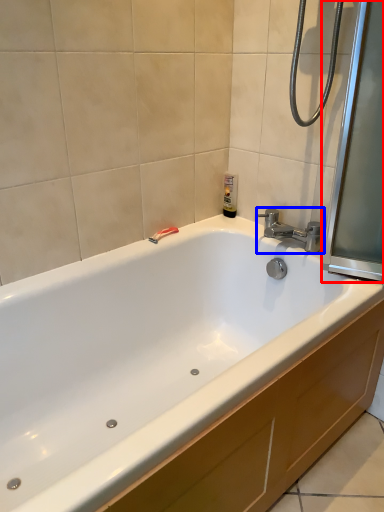
Question: Which object is further to the camera taking this photo, screen door (highlighted by a red box) or tap (highlighted by a blue box)?

Choices:
 (A) screen door
 (B) tap

Answer: (B)